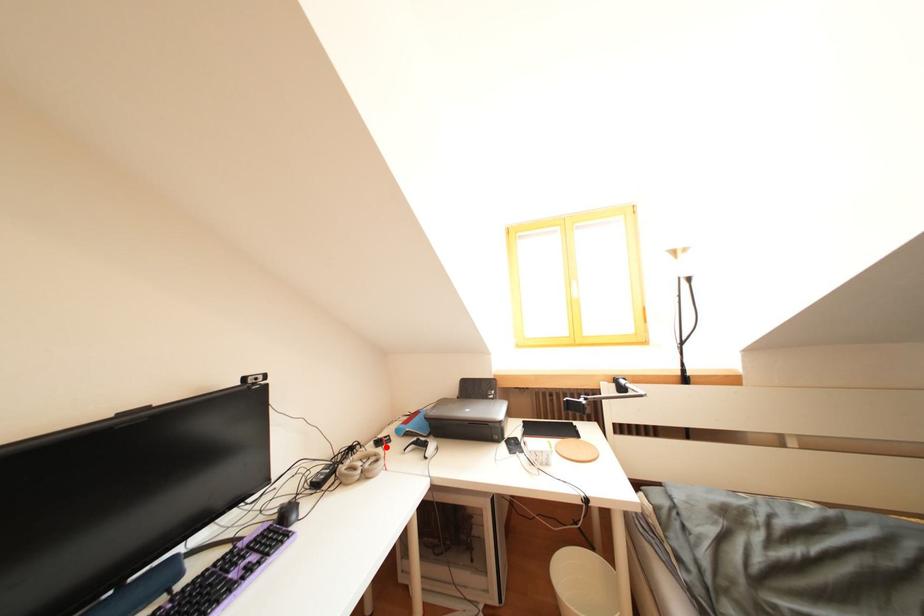
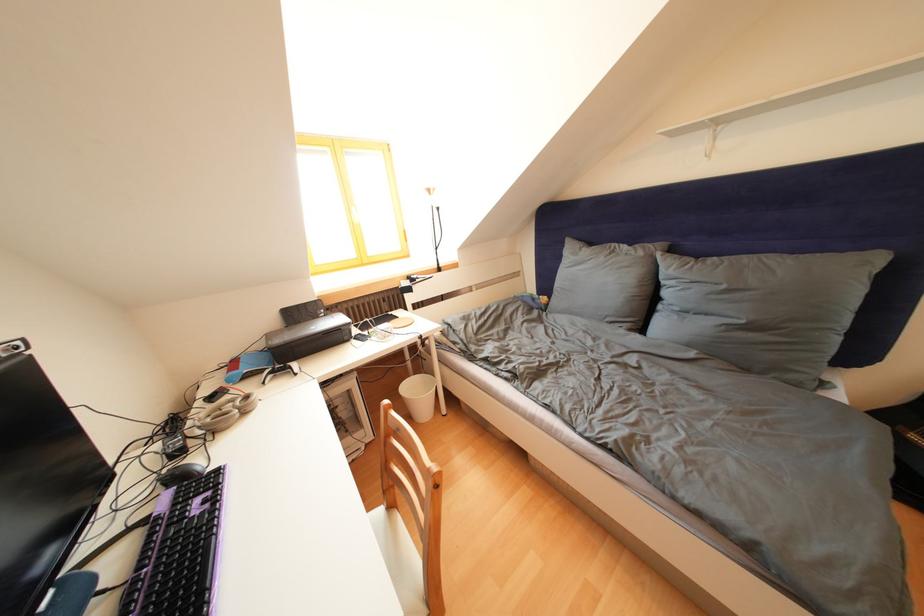
Where in the second image is the point corresponding to the highlighted location from the first image?

(220, 403)